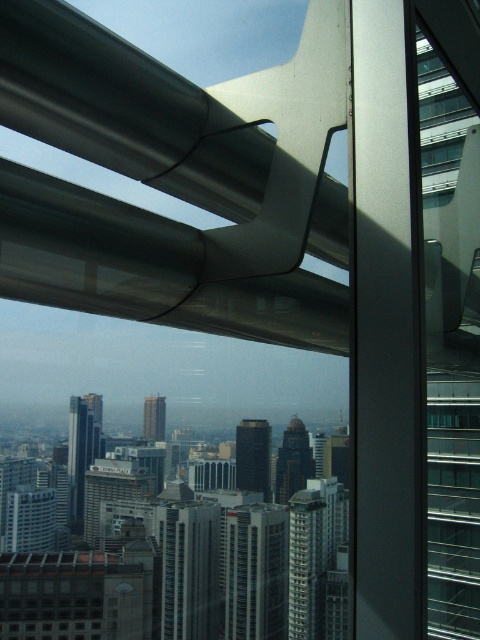
Question: Among these objects, which one is farthest from the camera?

Choices:
 (A) dark brown glass tower at center
 (B) silver metallic building at center
 (C) black glass tower at center

Answer: (B)

Question: Among these points, which one is farthest from the camera?

Choices:
 (A) (82, 452)
 (B) (308, 592)

Answer: (B)

Question: Can you confirm if black glass tower at center is bigger than dark brown glass tower at center?

Choices:
 (A) yes
 (B) no

Answer: (B)

Question: Which point is farther from the camera taking this photo?

Choices:
 (A) (305, 456)
 (B) (163, 403)
 (C) (305, 580)

Answer: (C)

Question: Does gray concrete building at center have a larger size compared to matte glass tower at center?

Choices:
 (A) yes
 (B) no

Answer: (A)

Question: Considering the relative positions of silver metallic building at center and dark brown glass tower at center in the image provided, where is silver metallic building at center located with respect to dark brown glass tower at center?

Choices:
 (A) below
 (B) above

Answer: (A)